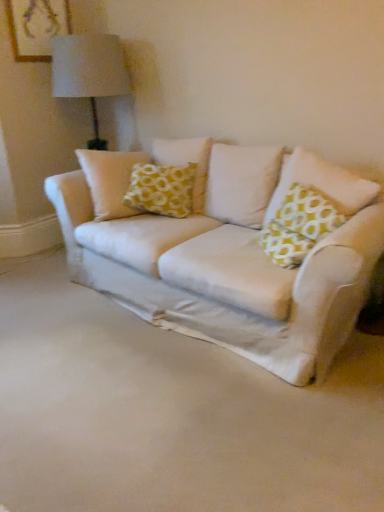
Locate an element on the screen. yellow printed cushion at right is located at coordinates (322, 183).

The width and height of the screenshot is (384, 512). Describe the element at coordinates (322, 183) in the screenshot. I see `yellow printed cushion at right` at that location.

The width and height of the screenshot is (384, 512). What are the coordinates of `yellow printed cushion at right` in the screenshot? It's located at (322, 183).